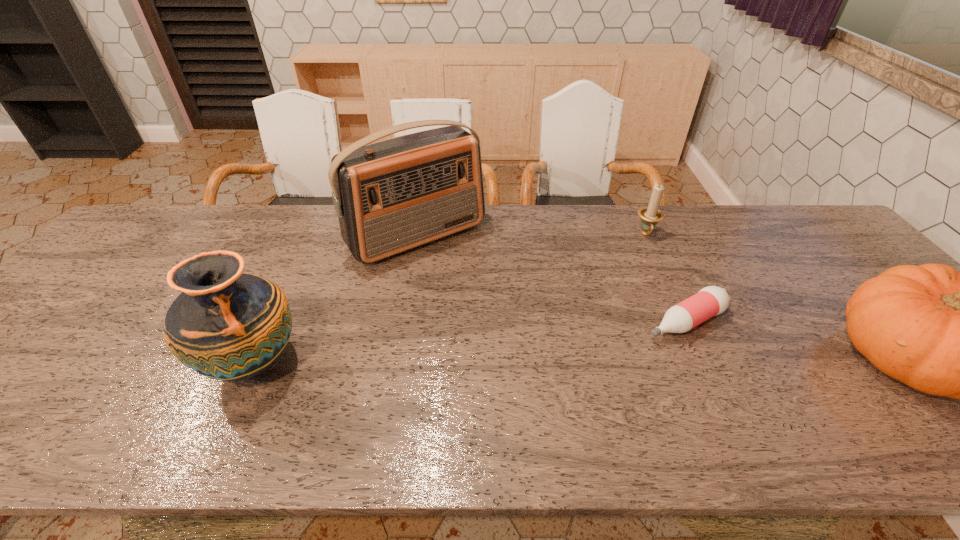
At what (x,y) coordinates should I click in order to perform the action: click on free spot on the desktop that is between the leftmost object and the third shortest object and is positioned on the front-facing side of the tallest object. Please return your answer as a coordinate pair (x, y). This screenshot has width=960, height=540. Looking at the image, I should click on 523,360.

Identify the location of free space on the desktop that is between the second tallest object and the rightmost object and is positioned with the cap open on the bottle. (619, 360).

Where is `free space on the desktop that is between the fourth shortest object and the rightmost object and is positioned on the handle side of the candle_holder`? free space on the desktop that is between the fourth shortest object and the rightmost object and is positioned on the handle side of the candle_holder is located at coordinates (673, 360).